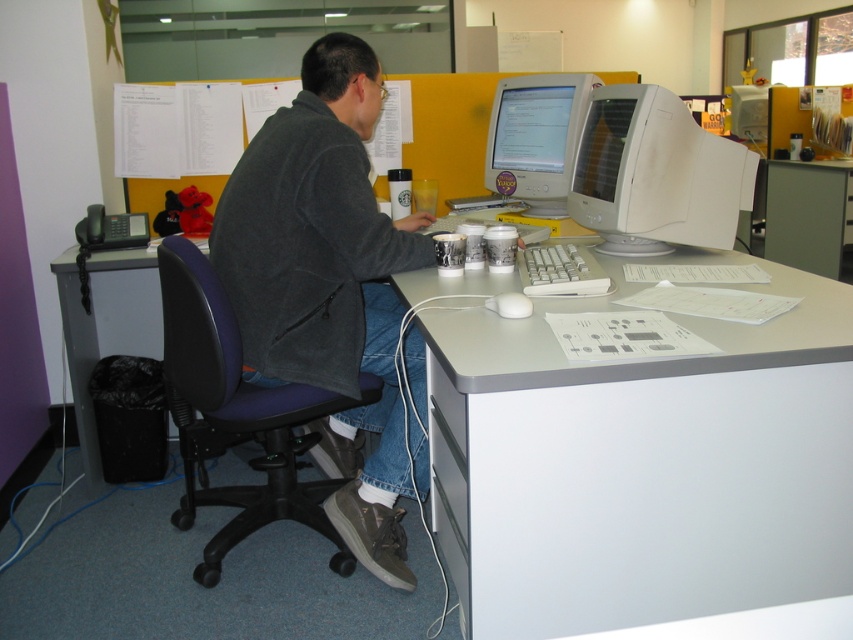
Question: Which object appears farthest from the camera in this image?

Choices:
 (A) dark gray jacket at center
 (B) white glossy monitor at upper center
 (C) white glossy computer monitor at upper right
 (D) white plastic computer at center

Answer: (B)

Question: Considering the real-world distances, which object is farthest from the matte white monitor at upper center?

Choices:
 (A) black leather swivel chair at left
 (B) white glossy monitor at upper center
 (C) white plastic computer at center

Answer: (A)

Question: Can you confirm if white glossy monitor at upper center is thinner than matte white monitor at upper center?

Choices:
 (A) no
 (B) yes

Answer: (A)

Question: Is dark gray jacket at center smaller than white glossy computer monitor at upper right?

Choices:
 (A) no
 (B) yes

Answer: (A)

Question: Is dark gray jacket at center to the right of white glossy computer monitor at upper right from the viewer's perspective?

Choices:
 (A) no
 (B) yes

Answer: (A)

Question: Which is nearer to the white plastic table at center?

Choices:
 (A) black leather swivel chair at left
 (B) white plastic computer at center
 (C) white glossy monitor at upper center
 (D) dark gray jacket at center

Answer: (C)